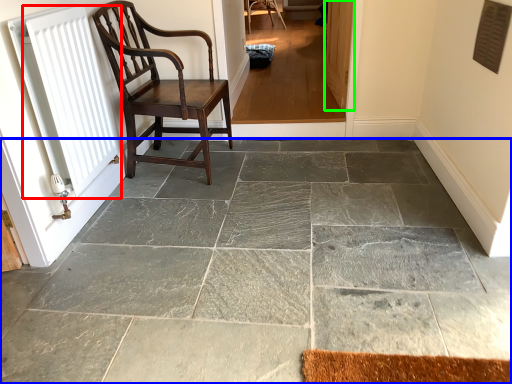
Question: Considering the real-world distances, which object is farthest from radiator (highlighted by a red box)? concrete (highlighted by a blue box) or screen door (highlighted by a green box)?

Choices:
 (A) concrete
 (B) screen door

Answer: (B)